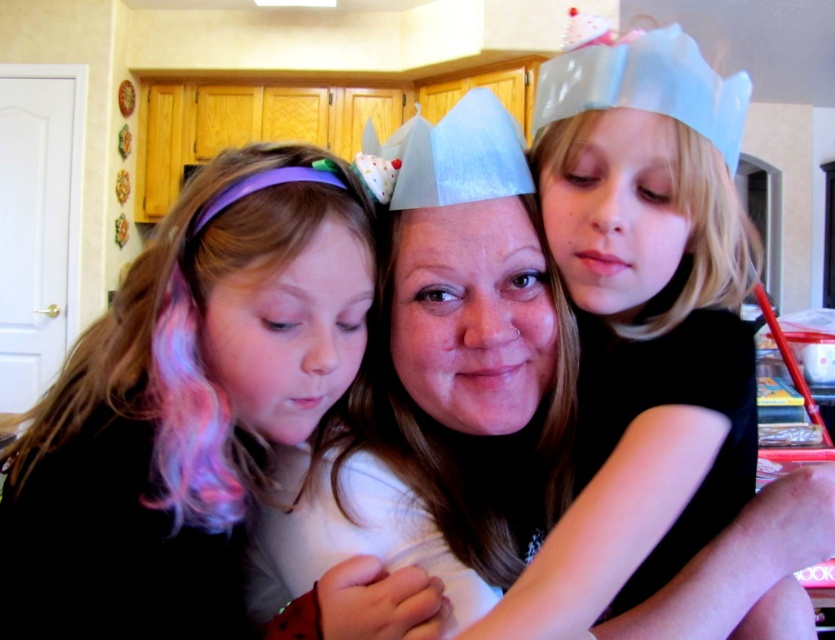
You are a photographer setting up for a family photo shoot in the kitchen. You notice the matte purple headband at left and the matte white crown at center. Which object is closer to the camera?

The matte purple headband at left is closer to the camera because it is in front of the matte white crown at center.

You are standing in the kitchen and want to place a small gift exactly where the purple headband at left is located. The gift is 0.05 units in size. Is there enough space at point (200,420) to place the gift without overlapping any other objects?

The purple headband at left is located at point (200,420). Since the gift is 0.05 units in size and the headband is a small accessory, there should be sufficient space to place the gift at that coordinate without overlapping other objects.